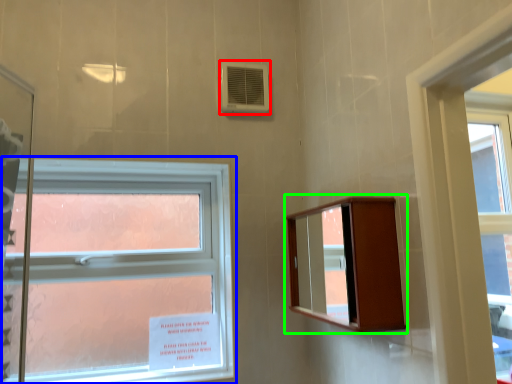
Question: Based on their relative distances, which object is farther from air conditioning (highlighted by a red box)? Choose from window (highlighted by a blue box) and medicine cabinet (highlighted by a green box).

Choices:
 (A) window
 (B) medicine cabinet

Answer: (B)